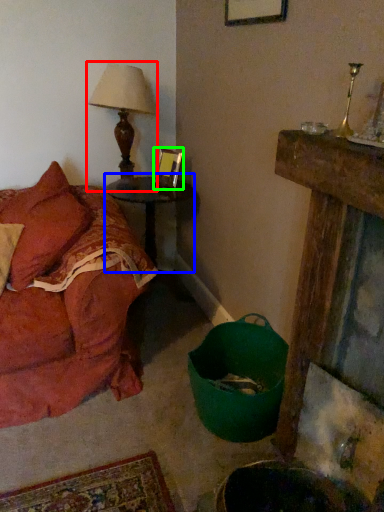
Question: Based on their relative distances, which object is farther from table lamp (highlighted by a red box)? Choose from table (highlighted by a blue box) and picture frame (highlighted by a green box).

Choices:
 (A) table
 (B) picture frame

Answer: (A)